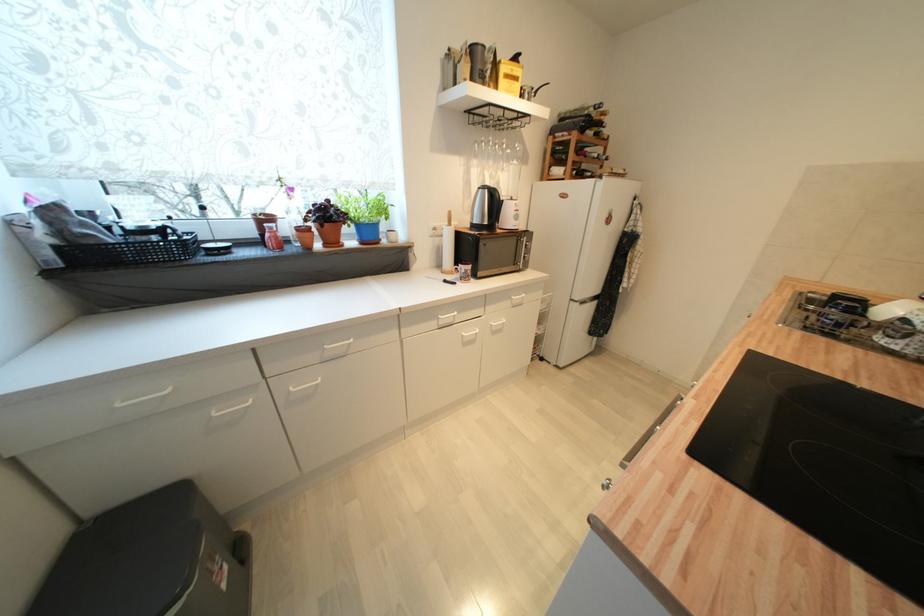
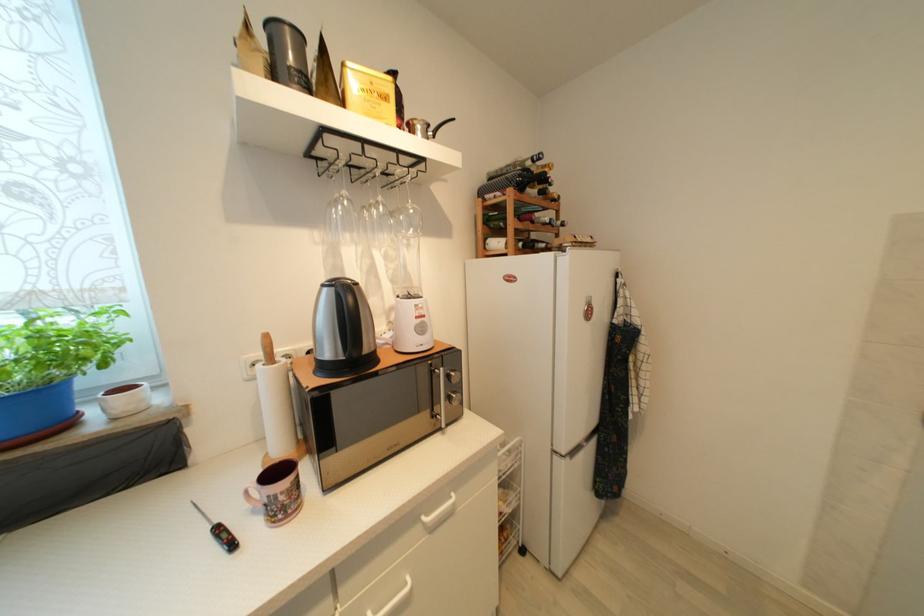
Looking at this image, what movement of the cameraman would produce the second image?

The cameraman moved toward right, forward.